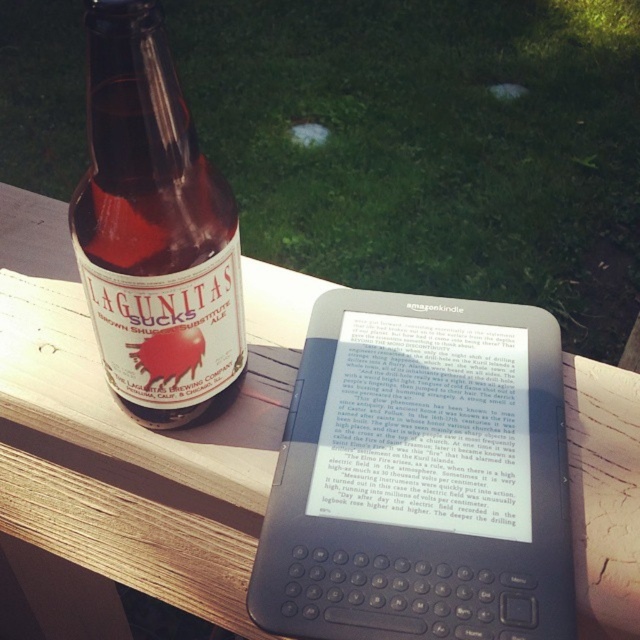
You are sitting on the wooden bench at upper left and want to grab the brown glass bottle at left. Can you reach it without standing up?

The wooden bench at upper left is much taller than the brown glass bottle at left, so you can easily reach it while sitting.

You are sitting on the wooden bench at upper left and want to place your drink, the brown glass bottle at left, on the surface. Considering the size difference between the bench and the bottle, will the bottle fit comfortably on the bench?

The wooden bench at upper left has a larger size compared to the brown glass bottle at left, so the bottle should fit comfortably on the bench.

What is the object located at the coordinates point (420, 477)?

The object located at point (420, 477) is the black plastic kindle at center.